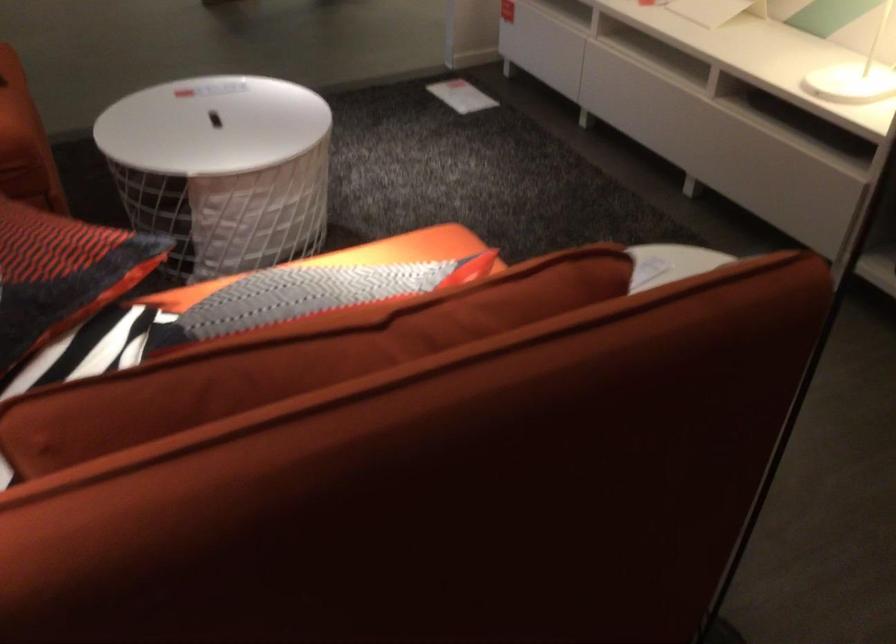
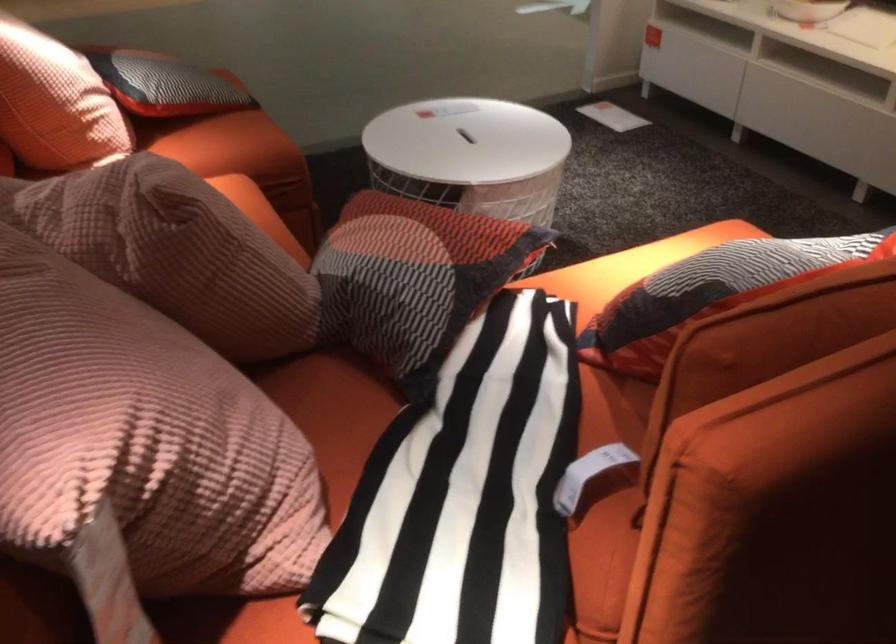
Question: In a continuous first-person perspective shot, in which direction is the camera moving?

Choices:
 (A) Left
 (B) Right
 (C) Forward
 (D) Backward

Answer: (A)